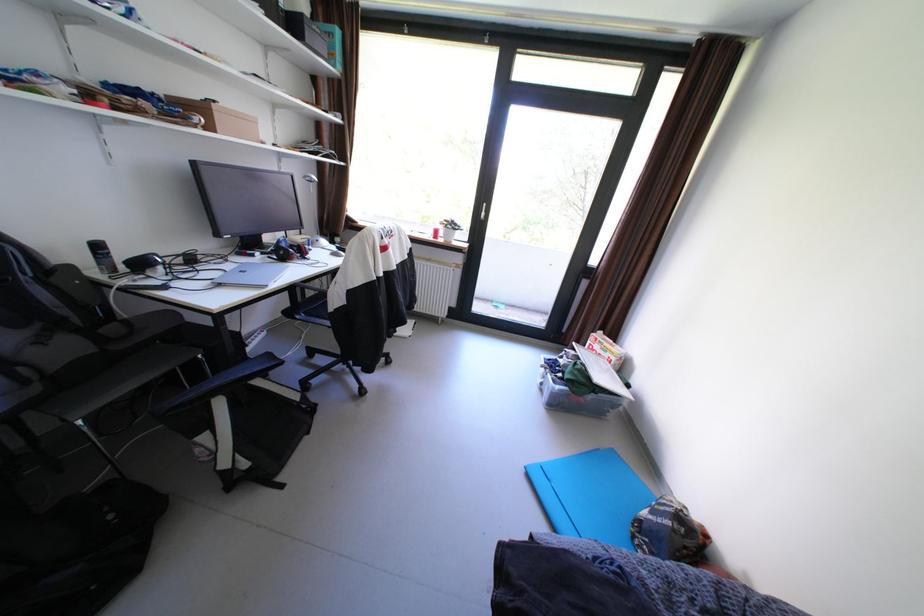
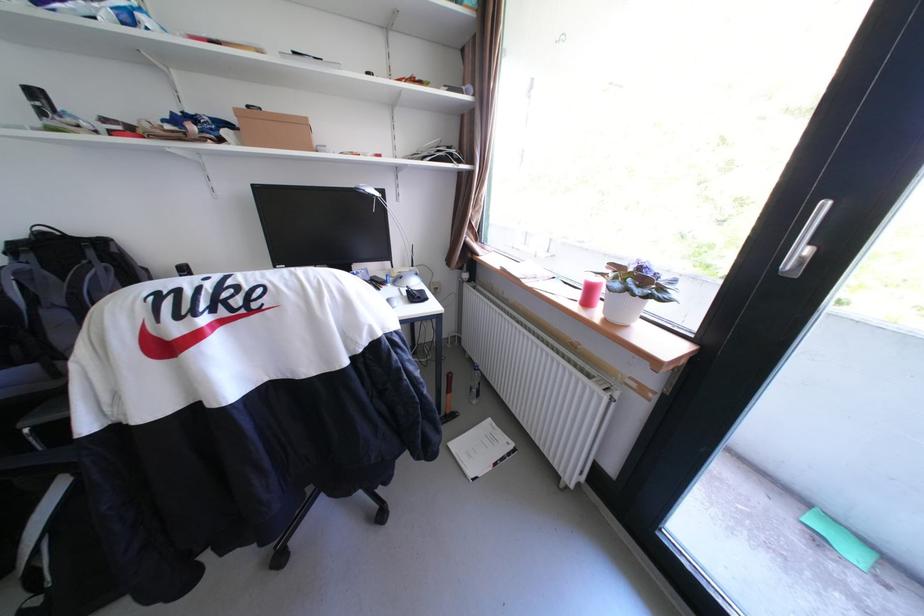
Where in the second image is the point corresponding to (493,215) from the first image?

(813, 253)